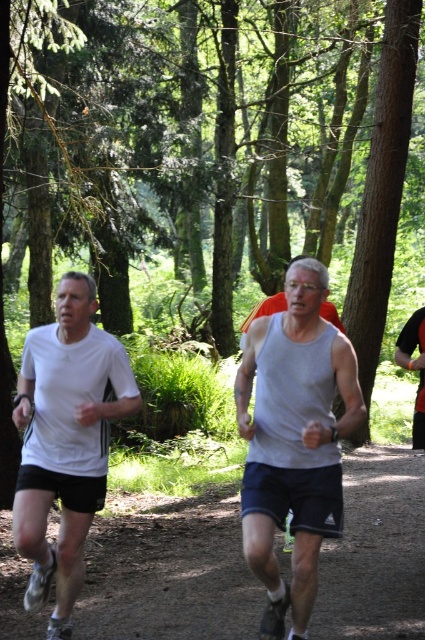
Question: Observing the image, what is the correct spatial positioning of white matte t-shirt at left in reference to black mesh tank top at right?

Choices:
 (A) left
 (B) right

Answer: (A)

Question: Which object is closer to the camera taking this photo?

Choices:
 (A) black mesh tank top at right
 (B) gray matte tank top at center
 (C) white matte t-shirt at left

Answer: (B)

Question: Which object is positioned closest to the white matte t-shirt at left?

Choices:
 (A) black mesh tank top at right
 (B) gray matte tank top at center

Answer: (B)

Question: Can you confirm if white matte t-shirt at left is positioned below black mesh tank top at right?

Choices:
 (A) no
 (B) yes

Answer: (B)

Question: Among these objects, which one is nearest to the camera?

Choices:
 (A) black mesh tank top at right
 (B) gray matte tank top at center

Answer: (B)

Question: Is gray matte tank top at center in front of black mesh tank top at right?

Choices:
 (A) yes
 (B) no

Answer: (A)